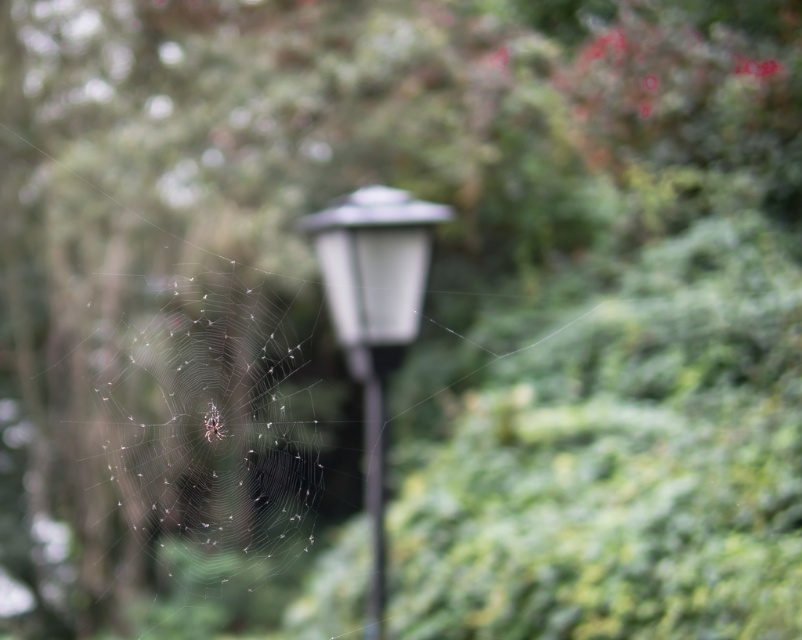
Is point (373, 577) closer to camera compared to point (223, 428)?

Yes, it is in front of point (223, 428).

Does point (375, 572) lie behind point (209, 403)?

No.

Image resolution: width=802 pixels, height=640 pixels. What are the coordinates of `black glass pole at center` in the screenshot? It's located at pyautogui.click(x=373, y=483).

Is white glossy street light at center taller than black glass pole at center?

Indeed, white glossy street light at center has a greater height compared to black glass pole at center.

Is point (298, 218) closer to camera compared to point (371, 449)?

No.

I want to click on white glossy street light at center, so click(x=375, y=317).

Identify the location of white glossy street light at center. This screenshot has height=640, width=802. (375, 317).

Who is positioned more to the right, translucent silk web at center or translucent silk spider at center?

translucent silk spider at center

Does translucent silk web at center have a larger size compared to translucent silk spider at center?

Indeed, translucent silk web at center has a larger size compared to translucent silk spider at center.

What do you see at coordinates (203, 416) in the screenshot?
I see `translucent silk web at center` at bounding box center [203, 416].

Locate an element on the screen. The image size is (802, 640). translucent silk web at center is located at coordinates (203, 416).